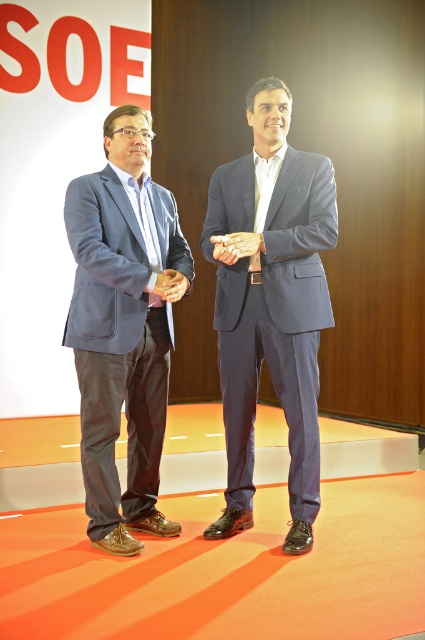
Between matte gray suit at left and matte brown leather hand at center, which one has more height?

Standing taller between the two is matte gray suit at left.

Is matte gray suit at left positioned before matte brown leather hand at center?

That is True.

Which is in front, point (141, 321) or point (173, 284)?

Point (173, 284)

Find the location of a particular element. The height and width of the screenshot is (640, 425). matte gray suit at left is located at coordinates (122, 328).

Between point (249, 454) and point (116, 524), which one is positioned behind?

The point (249, 454) is more distant.

Does point (306, 371) come behind point (130, 220)?

That is True.

Is point (272, 179) positioned behind point (105, 348)?

That is True.

I want to click on matte gray suit at center, so click(271, 301).

Between matte gray suit at center and matte brown leather hand at center, which one appears on the left side from the viewer's perspective?

From the viewer's perspective, matte brown leather hand at center appears more on the left side.

Describe the element at coordinates (271, 301) in the screenshot. I see `matte gray suit at center` at that location.

Between point (235, 234) and point (167, 289), which one is positioned behind?

The point (235, 234) is behind.

What are the coordinates of `matte gray suit at center` in the screenshot? It's located at 271,301.